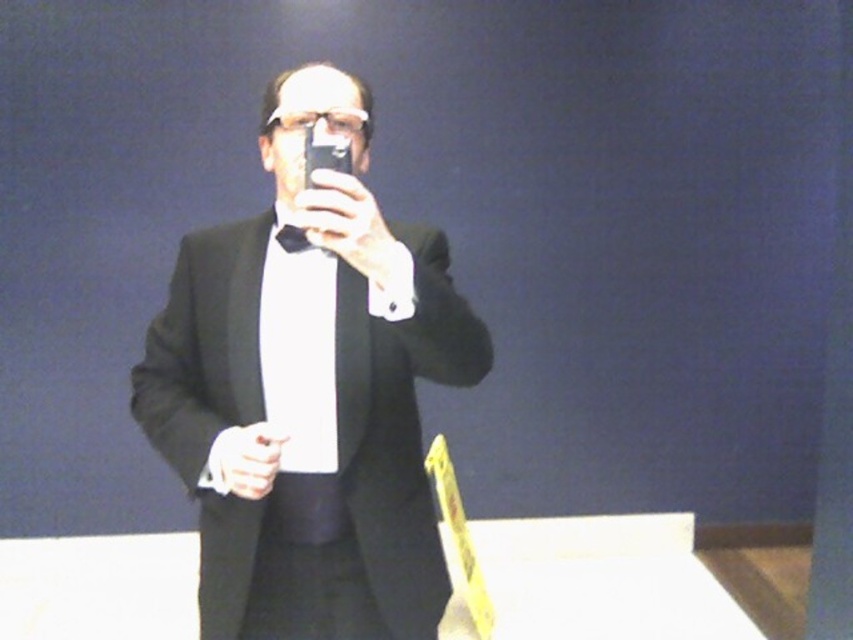
Can you confirm if black matte suit at center is wider than black satin bow tie at center?

Indeed, black matte suit at center has a greater width compared to black satin bow tie at center.

Is black matte suit at center thinner than black satin bow tie at center?

No, black matte suit at center is not thinner than black satin bow tie at center.

Locate an element on the screen. The image size is (853, 640). black matte suit at center is located at coordinates (309, 392).

You are a GUI agent. You are given a task and a screenshot of the screen. Output one action in this format:
    pyautogui.click(x=<x>, y=<y>)
    Task: Click on the black matte suit at center
    
    Given the screenshot: What is the action you would take?
    pyautogui.click(x=309, y=392)